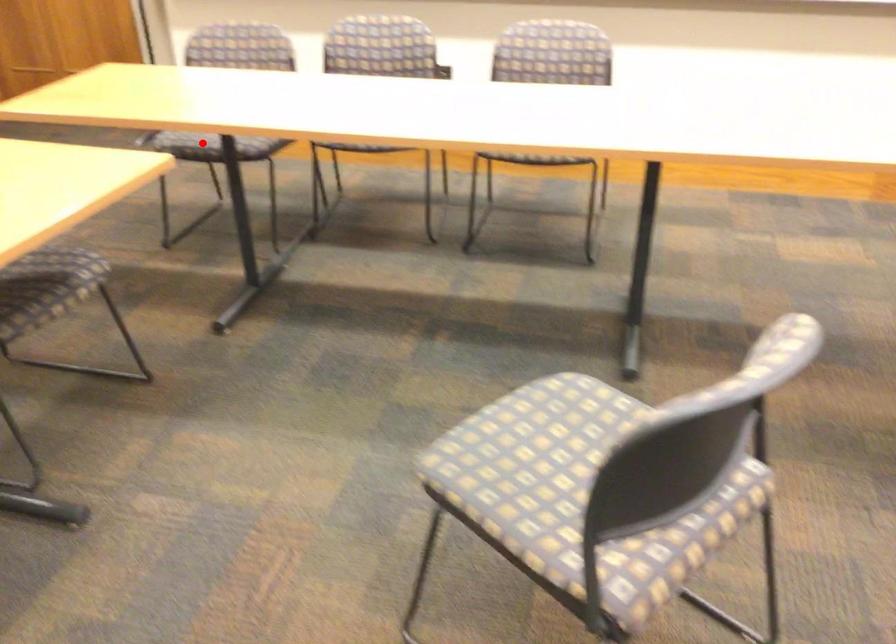
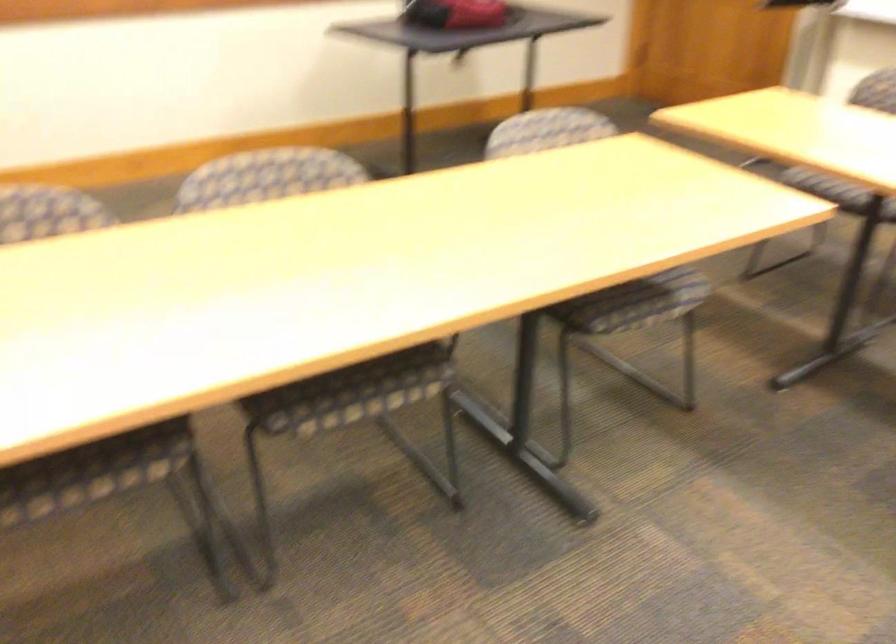
Find the pixel in the second image that matches the highlighted location in the first image.

(837, 192)